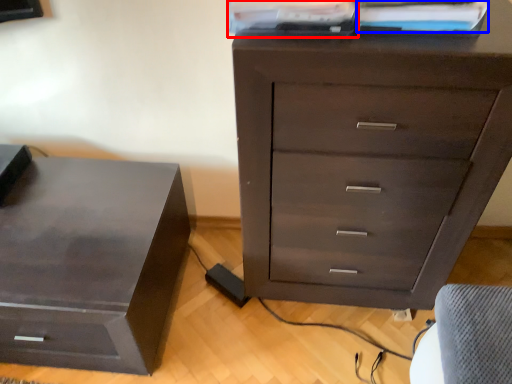
Question: Which of the following is the closest to the observer, book (highlighted by a red box) or book (highlighted by a blue box)?

Choices:
 (A) book
 (B) book

Answer: (A)